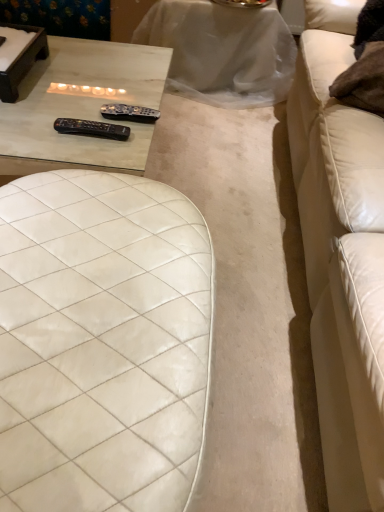
This screenshot has width=384, height=512. I want to click on vacant space situated above matte glass table at upper left, the second table viewed from the back (from a real-world perspective), so click(x=73, y=92).